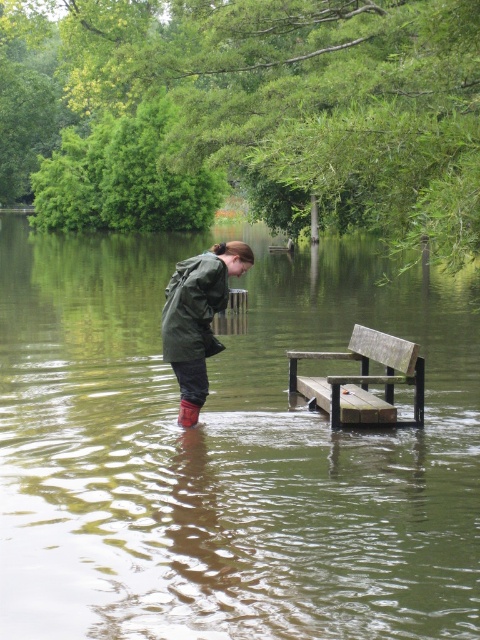
Who is lower down, green wood bench at center or wooden bench at lower center?

wooden bench at lower center is below.

Does green wood bench at center appear over wooden bench at lower center?

Yes.

Does point (186, 492) come behind point (399, 365)?

That is False.

The width and height of the screenshot is (480, 640). Identify the location of green wood bench at center. (227, 452).

Is olive-green waterproof jacket at center closer to camera compared to brown rubber rain boot at lower center?

That is True.

Between olive-green waterproof jacket at center and brown rubber rain boot at lower center, which one is positioned lower?

brown rubber rain boot at lower center is below.

I want to click on olive-green waterproof jacket at center, so click(199, 312).

Locate an element on the screen. olive-green waterproof jacket at center is located at coordinates (199, 312).

Who is more distant from viewer, (203, 390) or (228, 292)?

Positioned behind is point (203, 390).

Can you confirm if olive-green waterproof jacket at center is smaller than green matte jacket at center?

Yes.

Describe the element at coordinates (199, 312) in the screenshot. I see `olive-green waterproof jacket at center` at that location.

Where is `olive-green waterproof jacket at center`? olive-green waterproof jacket at center is located at coordinates (199, 312).